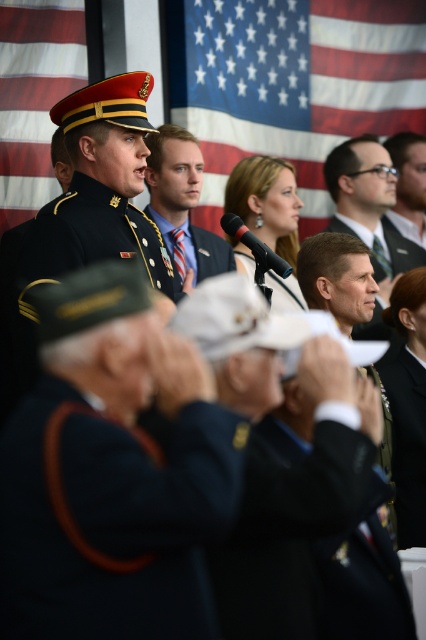
Question: Among these points, which one is farthest from the camera?

Choices:
 (A) (419, 147)
 (B) (397, 436)

Answer: (A)

Question: Which point is farther to the camera?

Choices:
 (A) (101, 472)
 (B) (419, 413)
 (C) (173, 13)

Answer: (C)

Question: Which point is closer to the camera?

Choices:
 (A) (316, 132)
 (B) (377, 161)
 (C) (181, 509)

Answer: (C)

Question: Does red flag at left appear on the left side of shiny gold buttons at center?

Choices:
 (A) no
 (B) yes

Answer: (B)

Question: Can you confirm if black fabric suit at center is wider than matte black suit at upper right?

Choices:
 (A) yes
 (B) no

Answer: (A)

Question: Where is matte black suit at center located in relation to matte black suit at upper right in the image?

Choices:
 (A) above
 (B) below

Answer: (B)